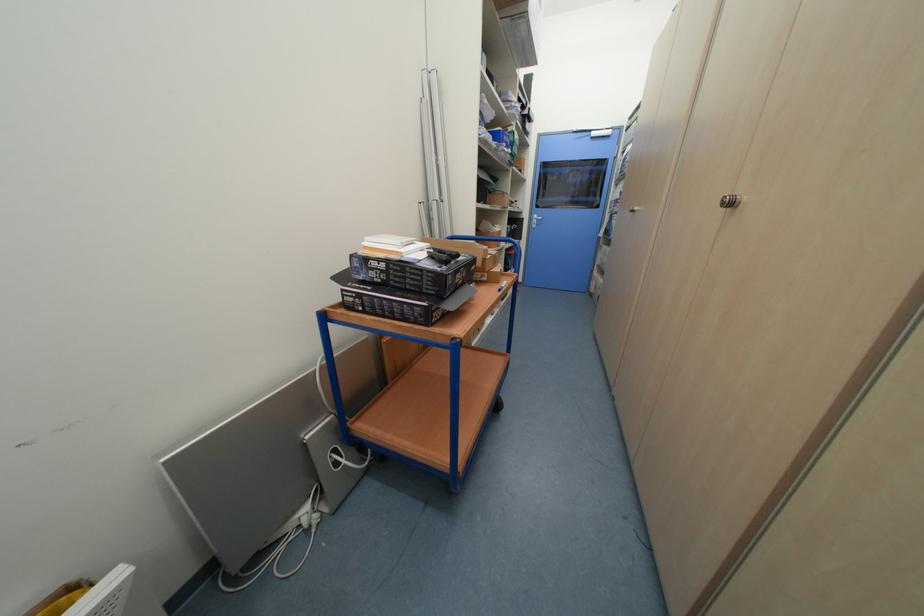
Where is `blue cart handle`? blue cart handle is located at coordinates (488, 238).